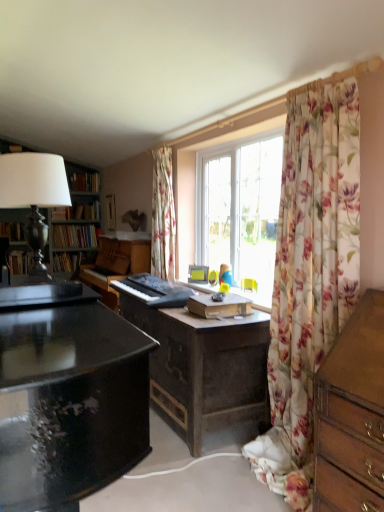
Question: Does matte yellow picture frame at center, which is counted as the second picture frame, starting from the left, have a smaller size compared to hardcover book at left, acting as the second book starting from the top?

Choices:
 (A) yes
 (B) no

Answer: (A)

Question: Is matte yellow picture frame at center, which is the 1th picture frame in front-to-back order, bigger than hardcover book at left, arranged as the 3th book when ordered from the bottom?

Choices:
 (A) no
 (B) yes

Answer: (A)

Question: Is matte yellow picture frame at center, placed as the second picture frame when sorted from top to bottom, shorter than hardcover book at left, arranged as the 3th book when ordered from the bottom?

Choices:
 (A) yes
 (B) no

Answer: (A)

Question: Is matte yellow picture frame at center, placed as the second picture frame when sorted from top to bottom, turned away from hardcover book at left, acting as the second book starting from the top?

Choices:
 (A) no
 (B) yes

Answer: (A)

Question: Can we say matte yellow picture frame at center, placed as the 1th picture frame when sorted from bottom to top, lies outside hardcover book at left, acting as the second book starting from the top?

Choices:
 (A) yes
 (B) no

Answer: (A)

Question: From the image's perspective, is hardcover book at left, which is the fourth book in top-to-bottom order, above or below hardcover book at left, the 4th book ordered from the bottom?

Choices:
 (A) above
 (B) below

Answer: (B)

Question: Considering the positions of hardcover book at left, which appears as the 1th book when ordered from the bottom, and hardcover book at left, marked as the 1th book in a top-to-bottom arrangement, in the image, is hardcover book at left, which appears as the 1th book when ordered from the bottom, taller or shorter than hardcover book at left, marked as the 1th book in a top-to-bottom arrangement,?

Choices:
 (A) short
 (B) tall

Answer: (A)

Question: Considering their positions, is hardcover book at left, which appears as the 1th book when ordered from the bottom, located in front of or behind hardcover book at left, marked as the 1th book in a top-to-bottom arrangement?

Choices:
 (A) behind
 (B) front

Answer: (A)

Question: Considering the positions of hardcover book at left, which appears as the 1th book when ordered from the bottom, and hardcover book at left, the 4th book ordered from the bottom, in the image, is hardcover book at left, which appears as the 1th book when ordered from the bottom, bigger or smaller than hardcover book at left, the 4th book ordered from the bottom,?

Choices:
 (A) small
 (B) big

Answer: (B)

Question: Considering their positions, is black matte keyboard at center located in front of or behind floral sheer curtain at right, placed as the 1th curtain when sorted from right to left?

Choices:
 (A) front
 (B) behind

Answer: (B)

Question: Is black matte keyboard at center taller or shorter than floral sheer curtain at right, which appears as the second curtain when viewed from the left?

Choices:
 (A) tall
 (B) short

Answer: (B)

Question: Looking at the image, does black matte keyboard at center seem bigger or smaller compared to floral sheer curtain at right, which appears as the second curtain when viewed from the left?

Choices:
 (A) small
 (B) big

Answer: (A)

Question: Does point (158, 302) appear closer or farther from the camera than point (317, 354)?

Choices:
 (A) closer
 (B) farther

Answer: (B)

Question: Considering the positions of point (158, 302) and point (190, 274), is point (158, 302) closer or farther from the camera than point (190, 274)?

Choices:
 (A) closer
 (B) farther

Answer: (A)

Question: Considering their positions, is black matte keyboard at center located in front of or behind matte yellow picture frame at center, the 1th picture frame positioned from the right?

Choices:
 (A) behind
 (B) front

Answer: (B)